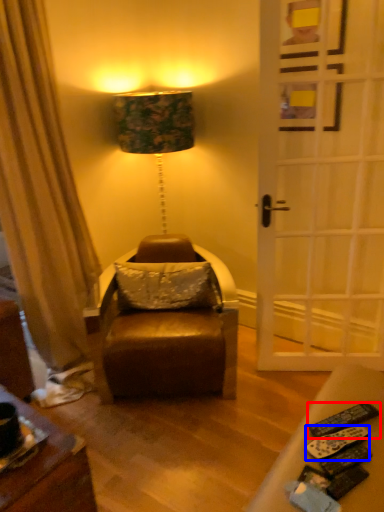
Question: Among these objects, which one is nearest to the camera, remote control (highlighted by a red box) or remote control (highlighted by a blue box)?

Choices:
 (A) remote control
 (B) remote control

Answer: (B)